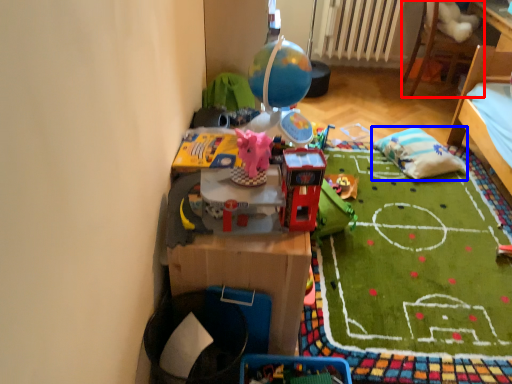
Question: Which object is further to the camera taking this photo, furniture (highlighted by a red box) or pillow (highlighted by a blue box)?

Choices:
 (A) furniture
 (B) pillow

Answer: (A)